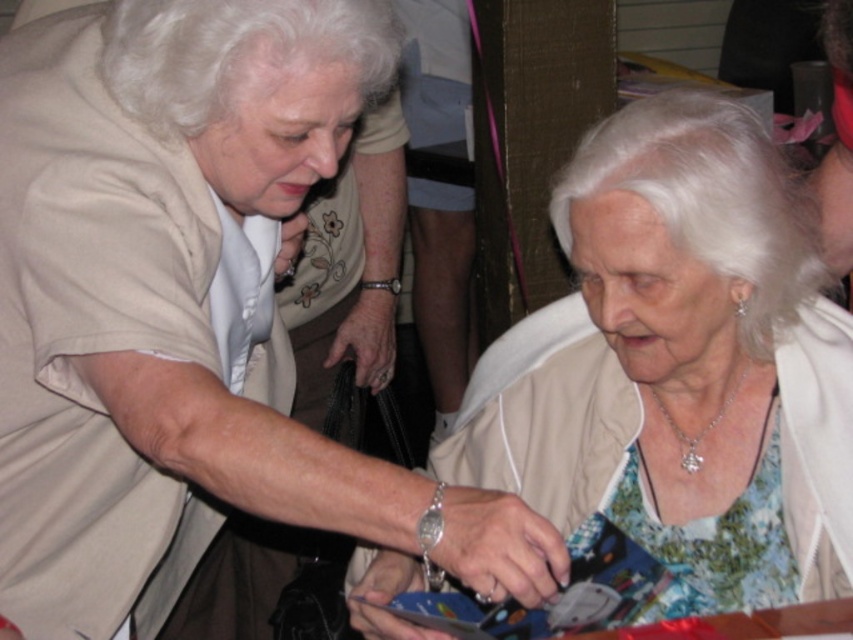
Question: Which point is farther to the camera?

Choices:
 (A) (340, 492)
 (B) (764, 467)

Answer: (B)

Question: Does matte beige blouse at center have a lesser width compared to matte beige jacket at center?

Choices:
 (A) yes
 (B) no

Answer: (A)

Question: Does matte beige blouse at center appear on the left side of matte beige jacket at center?

Choices:
 (A) no
 (B) yes

Answer: (B)

Question: Considering the relative positions of matte beige blouse at center and matte beige jacket at center in the image provided, where is matte beige blouse at center located with respect to matte beige jacket at center?

Choices:
 (A) below
 (B) above

Answer: (B)